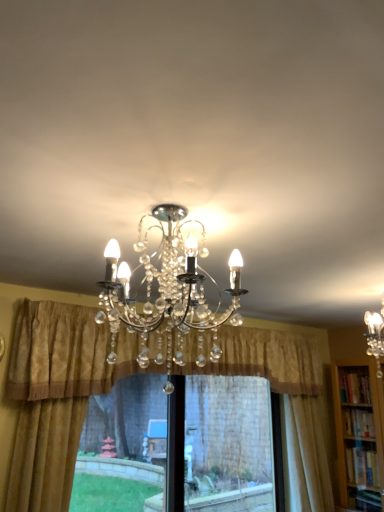
What is the approximate height of silky beige curtain at right, the third curtain from the left?

1.45 meters.

Based on the photo, measure the distance between green grass at lower left and camera.

green grass at lower left is 2.90 meters from camera.

The width and height of the screenshot is (384, 512). Describe the element at coordinates (48, 403) in the screenshot. I see `gold textured curtain at left, which is the third curtain from right to left` at that location.

What do you see at coordinates (229, 443) in the screenshot? I see `transparent plastic window screen at center` at bounding box center [229, 443].

Describe the element at coordinates (168, 291) in the screenshot. I see `clear crystal chandelier at center` at that location.

I want to click on silky beige curtain at right, which ranks as the 1th curtain in right-to-left order, so click(x=306, y=457).

From the image's perspective, which one is positioned lower, gold textured curtain at center, the second curtain viewed from the left, or green grass at lower left?

From the image's view, green grass at lower left is below.

Can you confirm if gold textured curtain at center, which ranks as the second curtain in right-to-left order, is wider than green grass at lower left?

Yes.

Does gold textured curtain at center, which ranks as the second curtain in right-to-left order, touch green grass at lower left?

They are not placed beside each other.

Image resolution: width=384 pixels, height=512 pixels. Find the location of `the 3rd curtain positioned above the green grass at lower left (from a real-world perspective)`. the 3rd curtain positioned above the green grass at lower left (from a real-world perspective) is located at coordinates (66, 353).

Is gold textured curtain at center, the second curtain viewed from the left, far away from silky beige curtain at right, the third curtain from the left?

Actually, gold textured curtain at center, the second curtain viewed from the left, and silky beige curtain at right, the third curtain from the left, are a little close together.

Identify the location of the 1st curtain to the left when counting from the silky beige curtain at right, the third curtain from the left. (66, 353).

Does point (271, 365) lie behind point (303, 422)?

No, it is in front of (303, 422).

Which of these two, gold textured curtain at center, the second curtain viewed from the left, or silky beige curtain at right, which ranks as the 1th curtain in right-to-left order, is bigger?

gold textured curtain at center, the second curtain viewed from the left.

Considering the positions of objects gold textured curtain at left, which is the third curtain from right to left, and clear crystal chandelier at center in the image provided, who is more to the right, gold textured curtain at left, which is the third curtain from right to left, or clear crystal chandelier at center?

clear crystal chandelier at center is more to the right.

From the image's perspective, which is below, gold textured curtain at left, marked as the first curtain in a left-to-right arrangement, or clear crystal chandelier at center?

gold textured curtain at left, marked as the first curtain in a left-to-right arrangement.

Is gold textured curtain at left, marked as the first curtain in a left-to-right arrangement, oriented away from clear crystal chandelier at center?

No, gold textured curtain at left, marked as the first curtain in a left-to-right arrangement,'s orientation is not away from clear crystal chandelier at center.

Is point (45, 398) closer to camera compared to point (210, 318)?

No, it is not.

From the picture: Which is further, (194, 279) or (59, 367)?

The point (59, 367) is farther from the camera.

Consider the image. Who is smaller, clear crystal chandelier at center or gold textured curtain at center, the second curtain viewed from the left?

clear crystal chandelier at center.

From the image's perspective, who appears lower, clear crystal chandelier at center or gold textured curtain at center, the second curtain viewed from the left?

gold textured curtain at center, the second curtain viewed from the left, is shown below in the image.

How different are the orientations of clear crystal chandelier at center and gold textured curtain at center, the second curtain viewed from the left, in degrees?

89.9 degrees.

Consider the image. Based on their positions, is silky beige curtain at right, which ranks as the 1th curtain in right-to-left order, located to the left or right of transparent plastic window screen at center?

silky beige curtain at right, which ranks as the 1th curtain in right-to-left order, is positioned on transparent plastic window screen at center's right side.

Is silky beige curtain at right, which ranks as the 1th curtain in right-to-left order, in front of transparent plastic window screen at center?

No.

From a real-world perspective, which object stands above the other?

silky beige curtain at right, which ranks as the 1th curtain in right-to-left order.

Is point (294, 420) closer or farther from the camera than point (210, 405)?

Clearly, point (294, 420) is closer to the camera than point (210, 405).

From the image's perspective, which is above, gold textured curtain at left, which is the third curtain from right to left, or transparent plastic window screen at center?

From the image's view, gold textured curtain at left, which is the third curtain from right to left, is above.

Is point (63, 308) less distant than point (208, 451)?

Yes, point (63, 308) is closer to viewer.

Can you confirm if gold textured curtain at left, marked as the first curtain in a left-to-right arrangement, is smaller than transparent plastic window screen at center?

Correct, gold textured curtain at left, marked as the first curtain in a left-to-right arrangement, occupies less space than transparent plastic window screen at center.

Does gold textured curtain at left, marked as the first curtain in a left-to-right arrangement, have a lesser height compared to transparent plastic window screen at center?

Incorrect, the height of gold textured curtain at left, marked as the first curtain in a left-to-right arrangement, does not fall short of that of transparent plastic window screen at center.

Identify the location of curtain to the left of green grass at lower left. The height and width of the screenshot is (512, 384). (48, 403).

What's the angular difference between gold textured curtain at left, which is the third curtain from right to left, and green grass at lower left's facing directions?

2.66 degrees separate the facing orientations of gold textured curtain at left, which is the third curtain from right to left, and green grass at lower left.

Considering the positions of objects gold textured curtain at left, which is the third curtain from right to left, and green grass at lower left in the image provided, who is more to the left, gold textured curtain at left, which is the third curtain from right to left, or green grass at lower left?

gold textured curtain at left, which is the third curtain from right to left, is more to the left.

Considering the sizes of gold textured curtain at left, which is the third curtain from right to left, and green grass at lower left in the image, is gold textured curtain at left, which is the third curtain from right to left, bigger or smaller than green grass at lower left?

Considering their sizes, gold textured curtain at left, which is the third curtain from right to left, takes up more space than green grass at lower left.

I want to click on bay window below the gold textured curtain at center, which ranks as the second curtain in right-to-left order (from the image's perspective), so click(x=228, y=444).

From a real-world perspective, which curtain is the 2nd one underneath the gold textured curtain at center, which ranks as the second curtain in right-to-left order? Please provide its 2D coordinates.

[(306, 457)]

Estimate the real-world distances between objects in this image. Which object is closer to transparent plastic window screen at center, green grass at lower left or clear crystal chandelier at center?

green grass at lower left is positioned closer to the anchor transparent plastic window screen at center.

When comparing their distances from silky beige curtain at right, the third curtain from the left, does transparent plastic window screen at center or gold textured curtain at center, which ranks as the second curtain in right-to-left order, seem closer?

gold textured curtain at center, which ranks as the second curtain in right-to-left order, is closer to silky beige curtain at right, the third curtain from the left.

Based on their spatial positions, is gold textured curtain at left, which is the third curtain from right to left, or green grass at lower left closer to clear crystal chandelier at center?

gold textured curtain at left, which is the third curtain from right to left.

Estimate the real-world distances between objects in this image. Which object is closer to clear crystal chandelier at center, silky beige curtain at right, which ranks as the 1th curtain in right-to-left order, or gold textured curtain at left, which is the third curtain from right to left?

gold textured curtain at left, which is the third curtain from right to left, lies closer to clear crystal chandelier at center than the other object.

Consider the image. Based on their spatial positions, is gold textured curtain at center, the second curtain viewed from the left, or clear crystal chandelier at center further from gold textured curtain at left, marked as the first curtain in a left-to-right arrangement?

gold textured curtain at center, the second curtain viewed from the left.

Estimate the real-world distances between objects in this image. Which object is closer to silky beige curtain at right, the third curtain from the left, green grass at lower left or gold textured curtain at left, marked as the first curtain in a left-to-right arrangement?

green grass at lower left lies closer to silky beige curtain at right, the third curtain from the left, than the other object.

Considering their positions, is clear crystal chandelier at center positioned closer to silky beige curtain at right, which ranks as the 1th curtain in right-to-left order, than gold textured curtain at left, marked as the first curtain in a left-to-right arrangement?

gold textured curtain at left, marked as the first curtain in a left-to-right arrangement, is closer to silky beige curtain at right, which ranks as the 1th curtain in right-to-left order.

Considering their positions, is transparent plastic window screen at center positioned closer to clear crystal chandelier at center than gold textured curtain at center, which ranks as the second curtain in right-to-left order?

gold textured curtain at center, which ranks as the second curtain in right-to-left order, is closer to clear crystal chandelier at center.

The height and width of the screenshot is (512, 384). What are the coordinates of `bay window positioned between clear crystal chandelier at center and silky beige curtain at right, which ranks as the 1th curtain in right-to-left order, from near to far` in the screenshot? It's located at (228, 444).

Locate an element on the screen. The width and height of the screenshot is (384, 512). bay window situated between gold textured curtain at left, which is the third curtain from right to left, and gold textured curtain at center, which ranks as the second curtain in right-to-left order, from left to right is located at coordinates (228, 444).

Find the location of a particular element. curtain between green grass at lower left and silky beige curtain at right, which ranks as the 1th curtain in right-to-left order, in the horizontal direction is located at coordinates (66, 353).

You are a GUI agent. You are given a task and a screenshot of the screen. Output one action in this format:
    pyautogui.click(x=<x>, y=<y>)
    Task: Click on the window screen located between clear crystal chandelier at center and silky beige curtain at right, which ranks as the 1th curtain in right-to-left order, in the depth direction
    
    Given the screenshot: What is the action you would take?
    pyautogui.click(x=229, y=443)